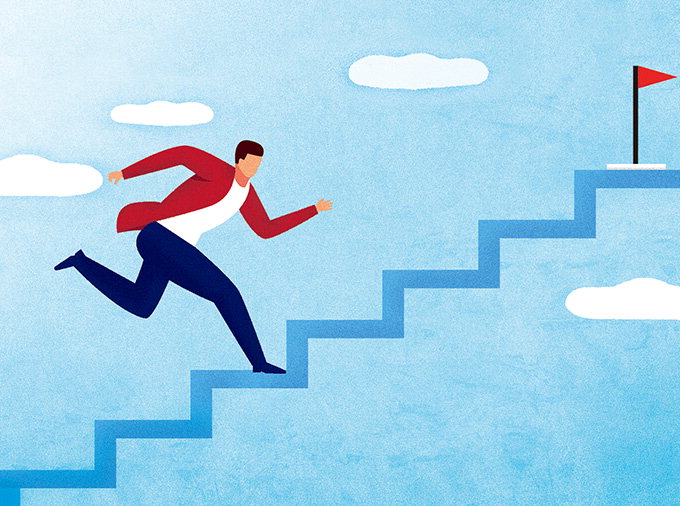
Locate an element on the screen. steps on staircase is located at coordinates (39, 478), (149, 424), (249, 378), (322, 321), (426, 278), (543, 223), (619, 177).